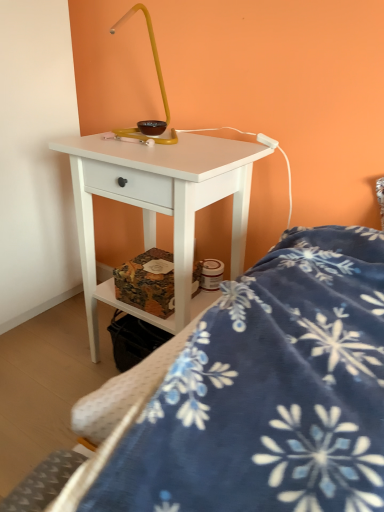
Where is `blank space situated above blue fleece blanket at lower right (from a real-world perspective)`? The width and height of the screenshot is (384, 512). blank space situated above blue fleece blanket at lower right (from a real-world perspective) is located at coordinates (286, 342).